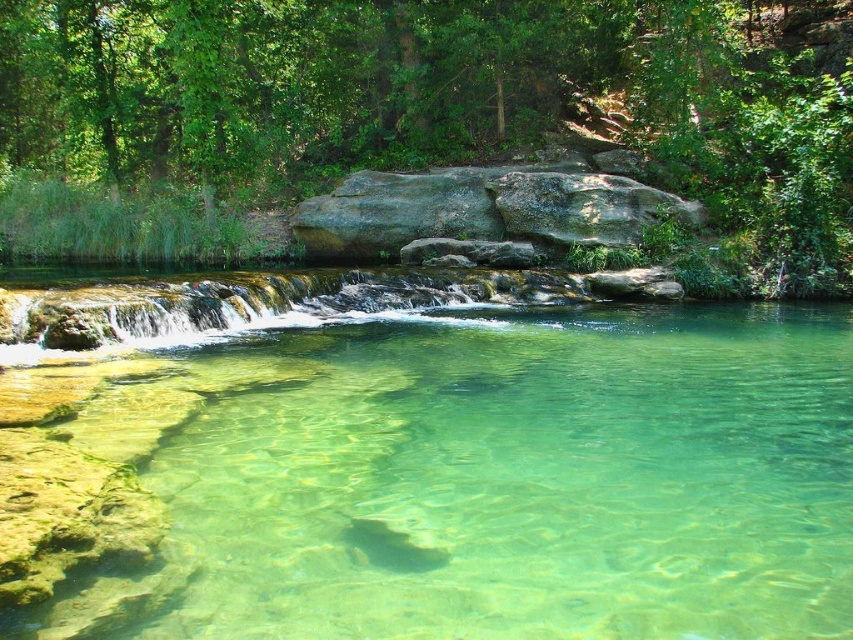
Question: Which of the following is the farthest from the observer?

Choices:
 (A) (294, 29)
 (B) (698, 380)

Answer: (A)

Question: Among these objects, which one is nearest to the camera?

Choices:
 (A) clear glassy stream at center
 (B) green leafy tree at upper center

Answer: (A)

Question: Does clear glassy stream at center have a greater width compared to green leafy tree at upper center?

Choices:
 (A) yes
 (B) no

Answer: (B)

Question: Is clear glassy stream at center positioned in front of green leafy tree at upper center?

Choices:
 (A) yes
 (B) no

Answer: (A)

Question: Which of the following is the farthest from the observer?

Choices:
 (A) clear glassy stream at center
 (B) green leafy tree at upper center

Answer: (B)

Question: Can you confirm if clear glassy stream at center is smaller than green leafy tree at upper center?

Choices:
 (A) no
 (B) yes

Answer: (B)